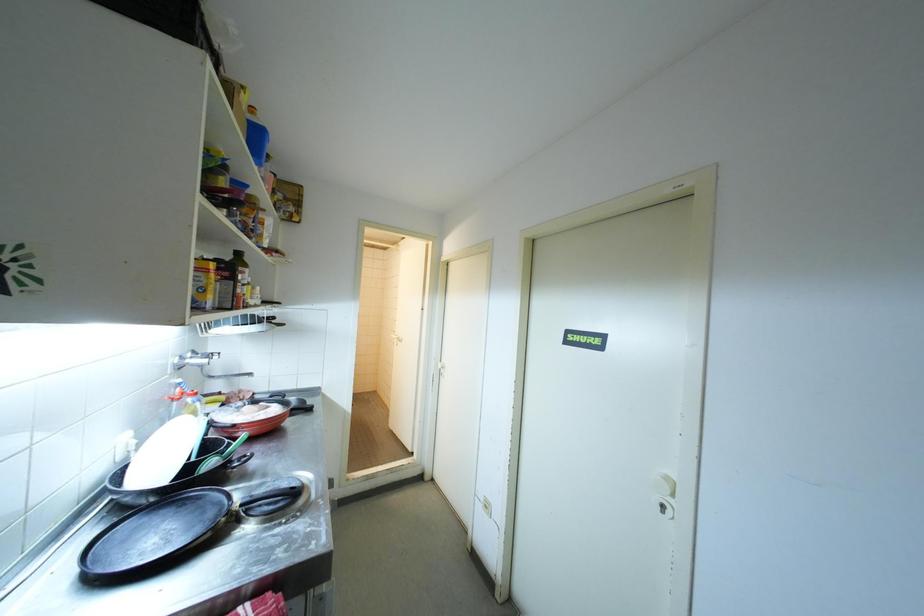
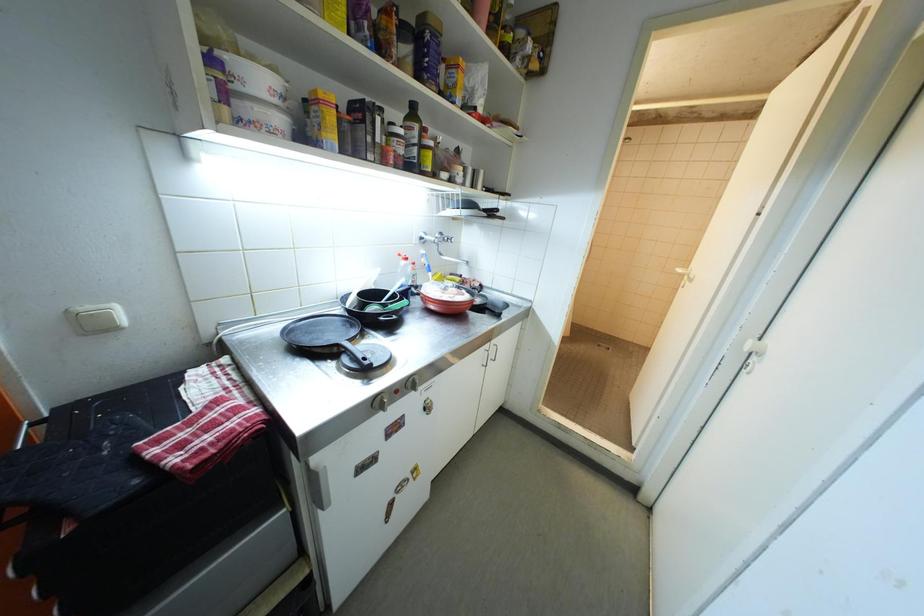
First-person continuous shooting, in which direction is the camera rotating?

The camera's rotation is toward left-down.